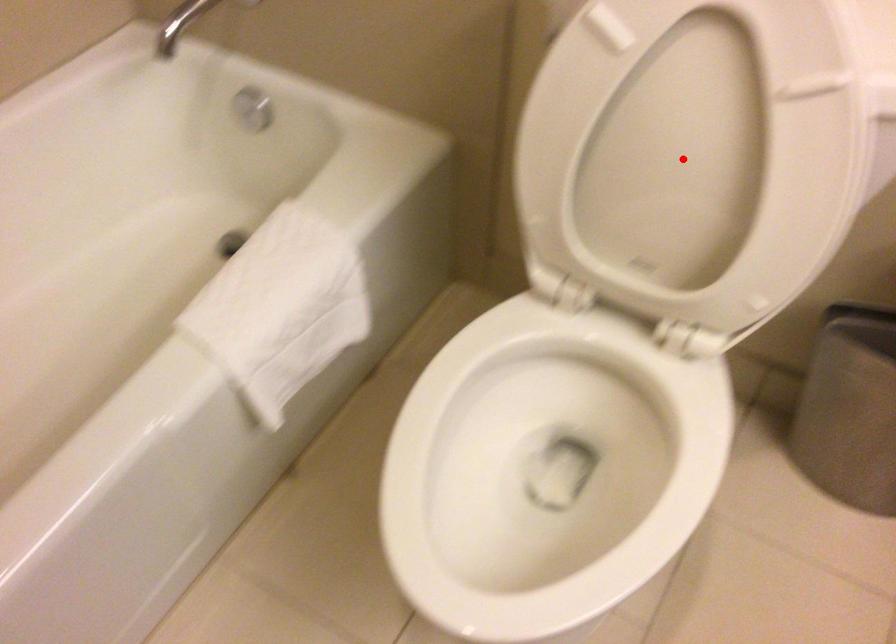
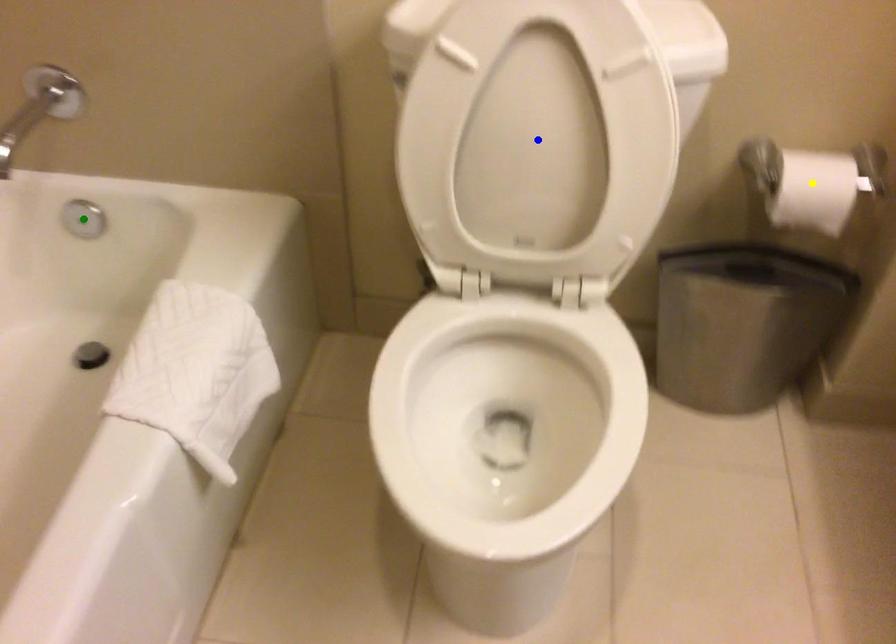
Question: I am providing you with two images of the same scene from different viewpoints. A red point is marked on the first image. You are given multiple points on the second image. Can you choose the point in image 2 that corresponds to the point in image 1?

Choices:
 (A) yellow point
 (B) green point
 (C) blue point

Answer: (C)